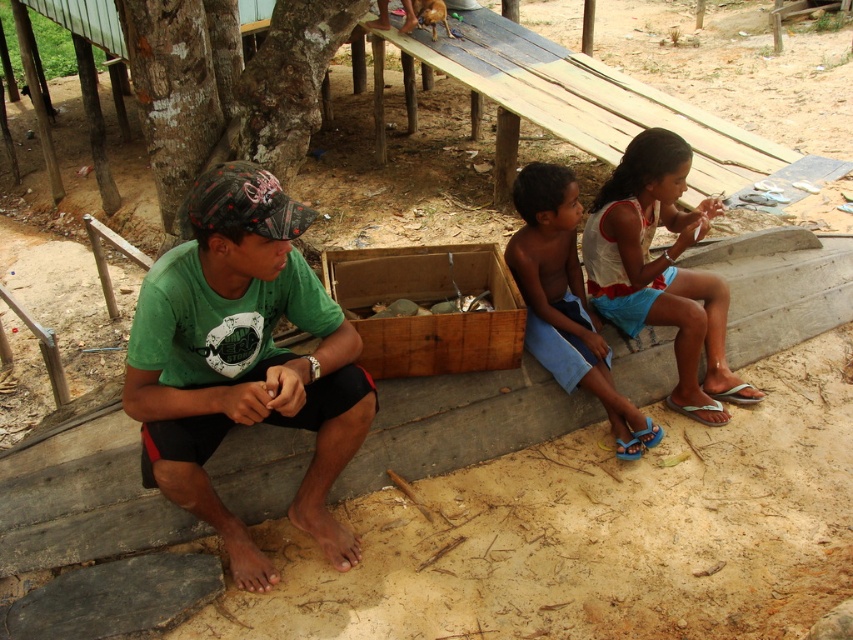
Can you confirm if green fabric shirt at center is positioned below blue fabric shorts at center?

Yes.

Who is taller, green fabric shirt at center or blue fabric shorts at center?

green fabric shirt at center

Does point (206, 515) come farther from viewer compared to point (537, 196)?

No, it is not.

The image size is (853, 640). I want to click on green fabric shirt at center, so click(242, 360).

Which is more to the right, green fabric shirt at center or white cotton shirt at center?

white cotton shirt at center is more to the right.

Can you confirm if green fabric shirt at center is positioned to the left of white cotton shirt at center?

Correct, you'll find green fabric shirt at center to the left of white cotton shirt at center.

Where is `green fabric shirt at center`? The width and height of the screenshot is (853, 640). green fabric shirt at center is located at coordinates (242, 360).

What are the coordinates of `green fabric shirt at center` in the screenshot? It's located at (242, 360).

Describe the element at coordinates (660, 269) in the screenshot. I see `white cotton shirt at center` at that location.

Can you confirm if white cotton shirt at center is thinner than blue fabric shorts at center?

No, white cotton shirt at center is not thinner than blue fabric shorts at center.

The width and height of the screenshot is (853, 640). Identify the location of white cotton shirt at center. (660, 269).

Where is `white cotton shirt at center`? The width and height of the screenshot is (853, 640). white cotton shirt at center is located at coordinates (660, 269).